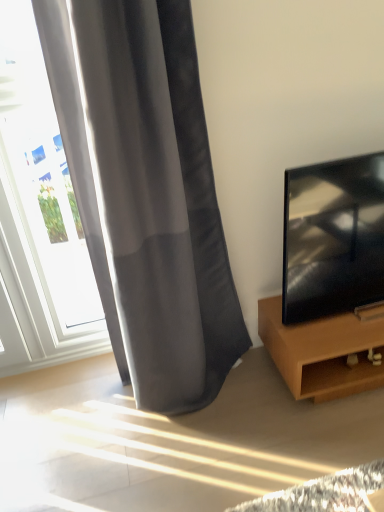
Image resolution: width=384 pixels, height=512 pixels. What are the coordinates of `free space in front of black glossy tv at right` in the screenshot? It's located at (345, 332).